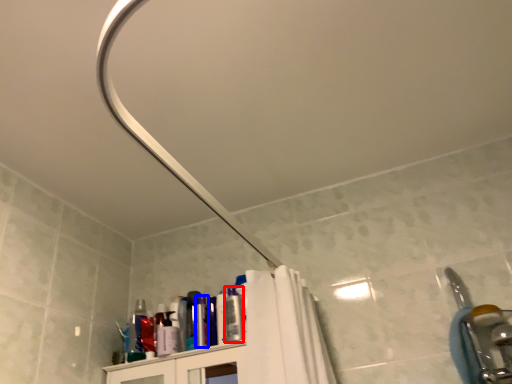
Question: Which object is closer to the camera taking this photo, toiletry (highlighted by a red box) or toiletry (highlighted by a blue box)?

Choices:
 (A) toiletry
 (B) toiletry

Answer: (A)